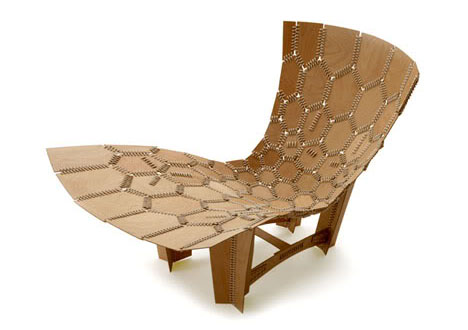
Find the location of a particular element. The width and height of the screenshot is (468, 330). left chair leg is located at coordinates (169, 253).